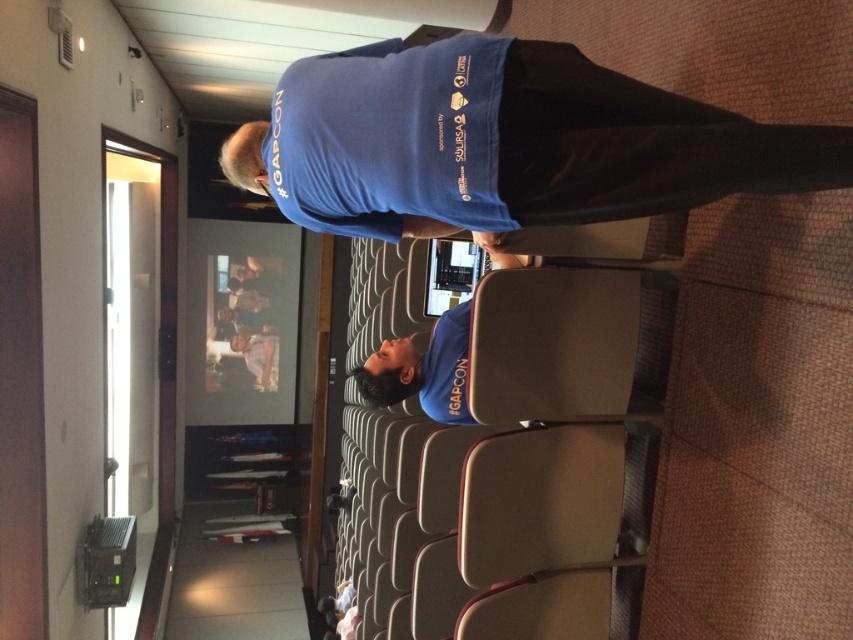
Question: Which object appears farthest from the camera in this image?

Choices:
 (A) blue matte shirt at lower center
 (B) blue fabric shirt at center
 (C) blue fabric at center

Answer: (C)

Question: Among these objects, which one is nearest to the camera?

Choices:
 (A) blue fabric shirt at center
 (B) blue matte shirt at lower center
 (C) blue fabric at center

Answer: (A)

Question: Which point appears farthest from the camera in this image?

Choices:
 (A) (373, 381)
 (B) (666, 189)

Answer: (A)

Question: Is blue matte shirt at lower center above blue fabric at center?

Choices:
 (A) yes
 (B) no

Answer: (A)

Question: Does blue fabric shirt at center appear on the left side of blue matte shirt at lower center?

Choices:
 (A) yes
 (B) no

Answer: (B)

Question: Can you confirm if blue fabric shirt at center is positioned to the right of blue matte shirt at lower center?

Choices:
 (A) no
 (B) yes

Answer: (B)